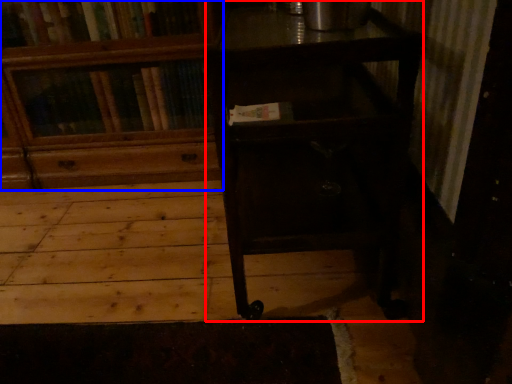
Question: Which object appears farthest to the camera in this image, table (highlighted by a red box) or bookcase (highlighted by a blue box)?

Choices:
 (A) table
 (B) bookcase

Answer: (B)